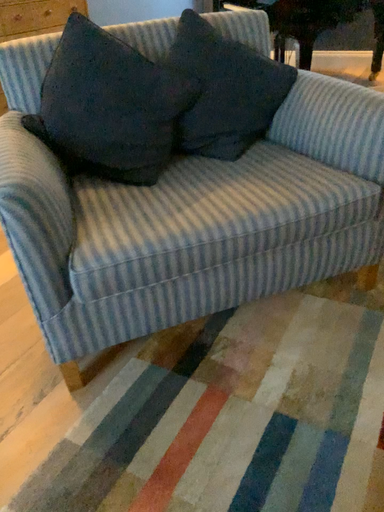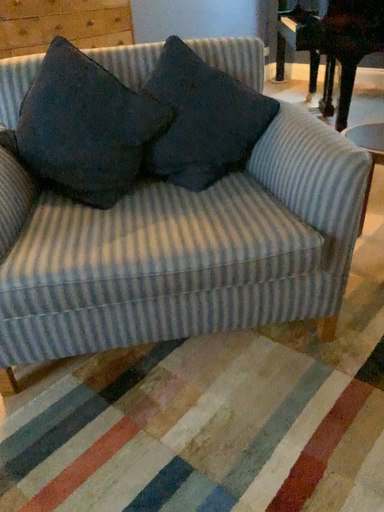
Question: Which way did the camera rotate in the video?

Choices:
 (A) rotated right
 (B) rotated left

Answer: (B)